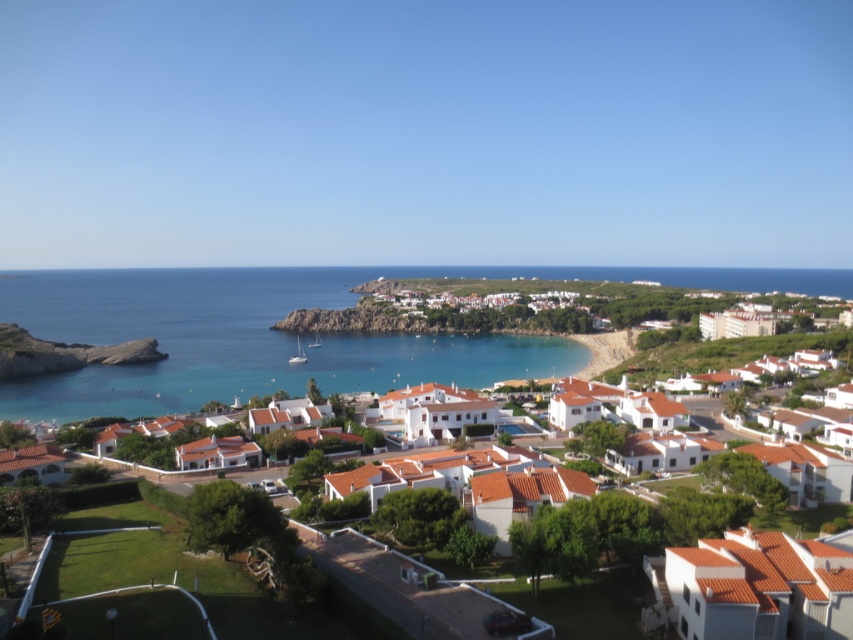
Question: From the image, what is the correct spatial relationship of white matte houses at center in relation to blue water at center?

Choices:
 (A) above
 (B) below

Answer: (B)

Question: Which object is farther from the camera taking this photo?

Choices:
 (A) white matte houses at center
 (B) blue water at center

Answer: (B)

Question: Which point is closer to the camera taking this photo?

Choices:
 (A) (9, 384)
 (B) (436, 376)

Answer: (A)

Question: Can you confirm if white matte houses at center is wider than blue water at center?

Choices:
 (A) yes
 (B) no

Answer: (A)

Question: Is white matte houses at center further to camera compared to blue water at center?

Choices:
 (A) yes
 (B) no

Answer: (B)